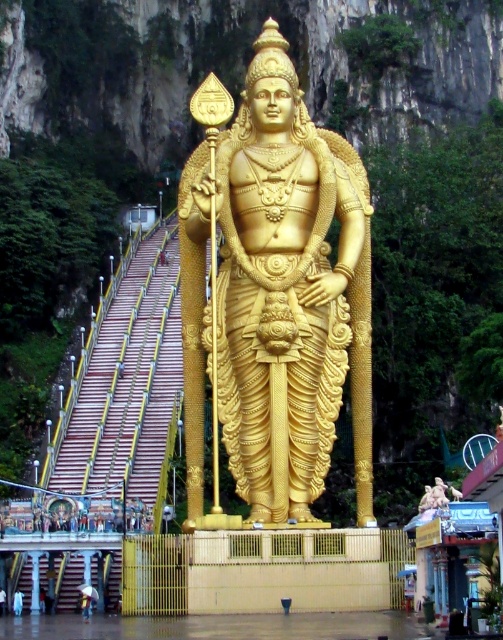
Does gold polished statue at center appear on the left side of golden statue at center?

Incorrect, gold polished statue at center is not on the left side of golden statue at center.

The width and height of the screenshot is (503, 640). Describe the element at coordinates (278, 298) in the screenshot. I see `gold polished statue at center` at that location.

Where is `gold polished statue at center`? gold polished statue at center is located at coordinates (278, 298).